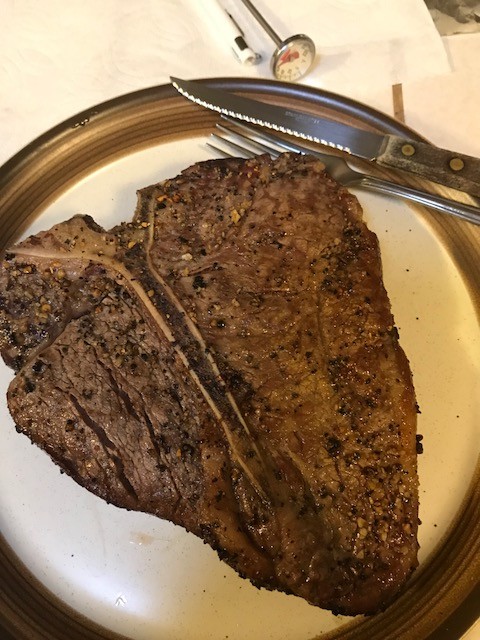
This screenshot has height=640, width=480. I want to click on plate left of steak, so click(x=51, y=540).